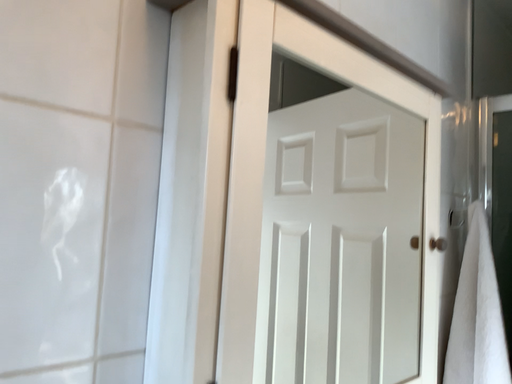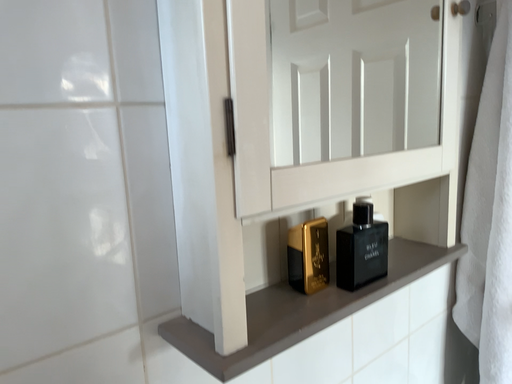
Question: How did the camera likely rotate when shooting the video?

Choices:
 (A) rotated downward
 (B) rotated upward

Answer: (A)